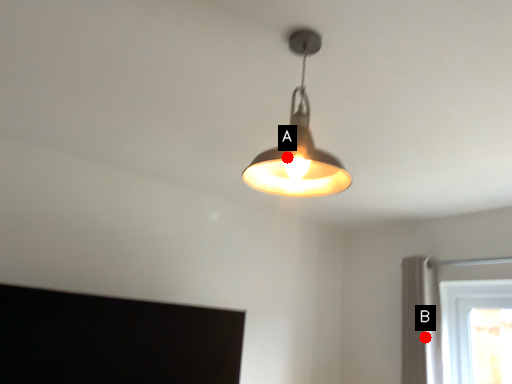
Question: Two points are circled on the image, labeled by A and B beside each circle. Which point appears farthest from the camera in this image?

Choices:
 (A) A is further
 (B) B is further

Answer: (B)